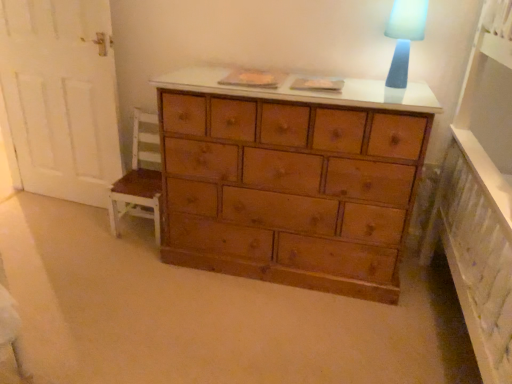
Find the location of a particular element. The image size is (512, 384). blue fabric lampshade at upper right is located at coordinates (404, 37).

Measure the distance between blue fabric lampshade at upper right and camera.

The distance of blue fabric lampshade at upper right from camera is 5.56 feet.

The height and width of the screenshot is (384, 512). What do you see at coordinates (404, 37) in the screenshot?
I see `blue fabric lampshade at upper right` at bounding box center [404, 37].

What do you see at coordinates (138, 180) in the screenshot?
I see `white painted wood chair at left` at bounding box center [138, 180].

What is the approximate height of white painted wood chair at left?

white painted wood chair at left is 25.56 inches tall.

The width and height of the screenshot is (512, 384). I want to click on white painted wood chair at left, so click(138, 180).

Where is `blue fabric lampshade at upper right`? The width and height of the screenshot is (512, 384). blue fabric lampshade at upper right is located at coordinates [404, 37].

Would you say blue fabric lampshade at upper right is to the left or to the right of white painted wood chair at left in the picture?

From the image, it's evident that blue fabric lampshade at upper right is to the right of white painted wood chair at left.

Is blue fabric lampshade at upper right positioned in front of white painted wood chair at left?

That is True.

Is point (414, 7) closer or farther from the camera than point (149, 140)?

Point (414, 7) is closer to the camera than point (149, 140).

From the image's perspective, would you say blue fabric lampshade at upper right is positioned over white painted wood chair at left?

Yes, from the image's perspective, blue fabric lampshade at upper right is over white painted wood chair at left.

From a real-world perspective, between blue fabric lampshade at upper right and white painted wood chair at left, who is vertically higher?

In real-world perspective, blue fabric lampshade at upper right is above.

Can you confirm if blue fabric lampshade at upper right is wider than white painted wood chair at left?

In fact, blue fabric lampshade at upper right might be narrower than white painted wood chair at left.

Considering the sizes of blue fabric lampshade at upper right and white painted wood chair at left in the image, is blue fabric lampshade at upper right taller or shorter than white painted wood chair at left?

Clearly, blue fabric lampshade at upper right is shorter compared to white painted wood chair at left.

From the picture: Between blue fabric lampshade at upper right and white painted wood chair at left, which one has smaller size?

Smaller between the two is blue fabric lampshade at upper right.

Which is correct: blue fabric lampshade at upper right is inside white painted wood chair at left, or outside of it?

The correct answer is: outside.

Is blue fabric lampshade at upper right directly adjacent to white painted wood chair at left?

No, blue fabric lampshade at upper right is not touching white painted wood chair at left.

Based on the photo, is blue fabric lampshade at upper right aimed at white painted wood chair at left?

No, blue fabric lampshade at upper right does not turn towards white painted wood chair at left.

Measure the distance from blue fabric lampshade at upper right to white painted wood chair at left.

They are 4.41 feet apart.

Locate an element on the screen. The height and width of the screenshot is (384, 512). armchair located below the blue fabric lampshade at upper right (from the image's perspective) is located at coordinates (138, 180).

Can you confirm if white painted wood chair at left is positioned to the right of blue fabric lampshade at upper right?

No, white painted wood chair at left is not to the right of blue fabric lampshade at upper right.

In the image, is white painted wood chair at left positioned in front of or behind blue fabric lampshade at upper right?

white painted wood chair at left is positioned farther from the viewer than blue fabric lampshade at upper right.

Is point (143, 185) positioned behind point (394, 67)?

Yes, it is behind point (394, 67).

From the image's perspective, relative to blue fabric lampshade at upper right, is white painted wood chair at left above or below?

white painted wood chair at left is below blue fabric lampshade at upper right.

From a real-world perspective, which object rests below the other?

white painted wood chair at left, from a real-world perspective.

Considering the sizes of white painted wood chair at left and blue fabric lampshade at upper right in the image, is white painted wood chair at left wider or thinner than blue fabric lampshade at upper right?

white painted wood chair at left is wider than blue fabric lampshade at upper right.

Does white painted wood chair at left have a lesser height compared to blue fabric lampshade at upper right?

No.

In the scene shown: Which of these two, white painted wood chair at left or blue fabric lampshade at upper right, is smaller?

Smaller between the two is blue fabric lampshade at upper right.

Would you say white painted wood chair at left is inside or outside blue fabric lampshade at upper right?

white painted wood chair at left is located beyond the bounds of blue fabric lampshade at upper right.

Are white painted wood chair at left and blue fabric lampshade at upper right located far from each other?

white painted wood chair at left is far away from blue fabric lampshade at upper right.

Is blue fabric lampshade at upper right at the back of white painted wood chair at left?

No, white painted wood chair at left is not facing the opposite direction of blue fabric lampshade at upper right.

This screenshot has height=384, width=512. In order to click on armchair beneath the blue fabric lampshade at upper right (from a real-world perspective) in this screenshot , I will do coord(138,180).

Find the location of a particular element. This screenshot has width=512, height=384. armchair on the left of blue fabric lampshade at upper right is located at coordinates (138, 180).

The width and height of the screenshot is (512, 384). In order to click on lamp located above the white painted wood chair at left (from the image's perspective) in this screenshot , I will do `click(404, 37)`.